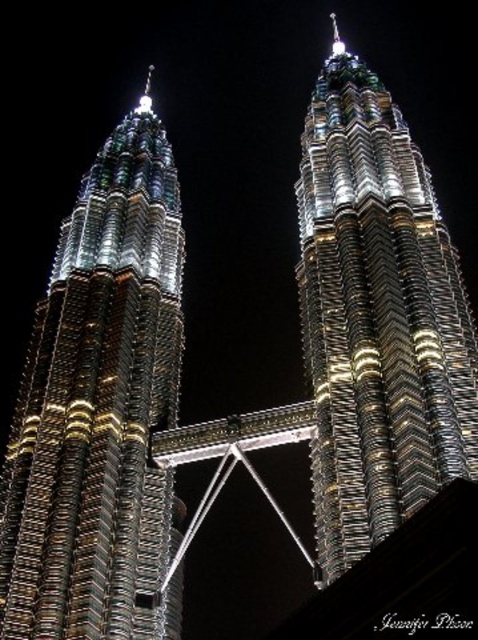
Find the location of a particular element. The height and width of the screenshot is (640, 478). metallic glass skyscraper at left is located at coordinates (98, 404).

Who is positioned more to the left, metallic glass skyscraper at left or metallic glass skyscraper at center?

metallic glass skyscraper at left

Which is in front, point (134, 339) or point (352, 60)?

Point (134, 339)

The height and width of the screenshot is (640, 478). I want to click on metallic glass skyscraper at left, so 98,404.